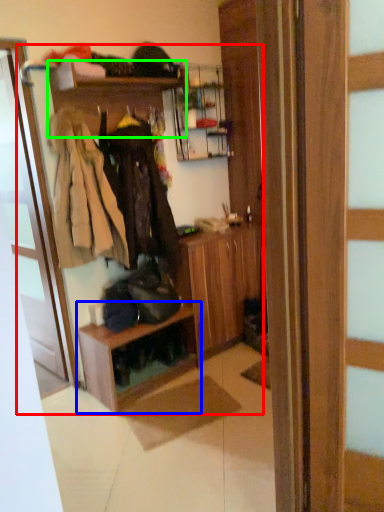
Question: Which is nearer to the dresser (highlighted by a red box)? shelf (highlighted by a blue box) or shelf (highlighted by a green box).

Choices:
 (A) shelf
 (B) shelf

Answer: (A)